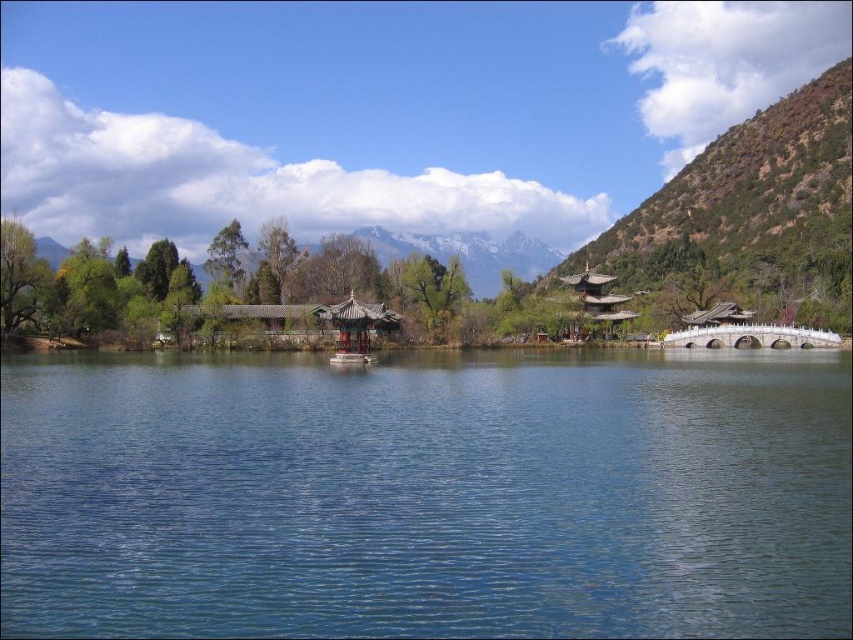
Question: Can you confirm if transparent blue water at center is positioned above green textured mountain at upper right?

Choices:
 (A) yes
 (B) no

Answer: (B)

Question: Which point is closer to the camera?

Choices:
 (A) transparent blue water at center
 (B) green textured mountain at upper right

Answer: (A)

Question: From the image, what is the correct spatial relationship of transparent blue water at center in relation to green textured mountain at upper right?

Choices:
 (A) below
 (B) above

Answer: (A)

Question: Is transparent blue water at center wider than green textured mountain at upper right?

Choices:
 (A) yes
 (B) no

Answer: (B)